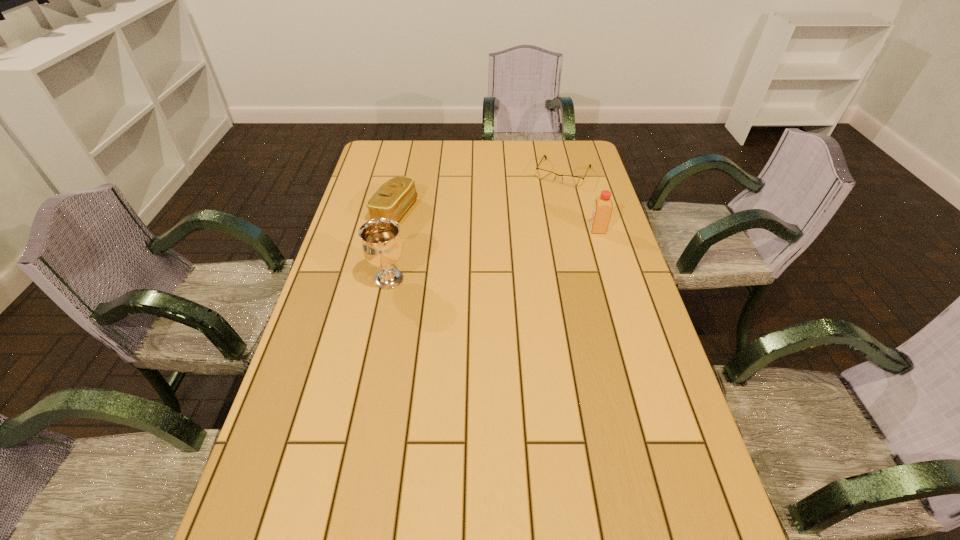
The height and width of the screenshot is (540, 960). Identify the location of vacant space located 0.110m on the zipper side of the clutch bag. (443, 227).

The image size is (960, 540). What are the coordinates of `free space located on the zipper side of the clutch bag` in the screenshot? It's located at (511, 247).

At what (x,y) coordinates should I click in order to perform the action: click on vacant space positioned on the zipper side of the clutch bag. Please return your answer as a coordinate pair (x, y). This screenshot has width=960, height=540. Looking at the image, I should click on click(523, 251).

At what (x,y) coordinates should I click in order to perform the action: click on vacant space located 0.170m on the front-facing side of the shortest object. Please return your answer as a coordinate pair (x, y). Looking at the image, I should click on (542, 213).

At what (x,y) coordinates should I click in order to perform the action: click on free space located on the front-facing side of the shortest object. Please return your answer as a coordinate pair (x, y). Looking at the image, I should click on (527, 244).

The width and height of the screenshot is (960, 540). I want to click on vacant space located on the front-facing side of the shortest object, so click(545, 208).

Locate an element on the screen. The image size is (960, 540). object situated at the far edge is located at coordinates (573, 181).

This screenshot has height=540, width=960. I want to click on chalice that is at the left edge, so click(382, 246).

Where is `clutch bag located in the left edge section of the desktop`? Image resolution: width=960 pixels, height=540 pixels. clutch bag located in the left edge section of the desktop is located at coordinates (391, 200).

I want to click on orange juice that is at the right edge, so click(x=603, y=205).